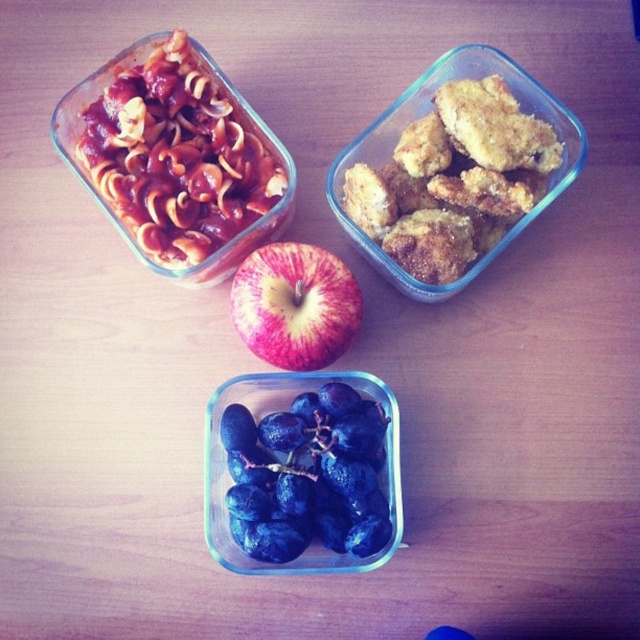
You are a food delivery person who needs to pack the crispy golden nuggets at upper right and the red matte apple at center into a small box. The box can only fit items that are both smaller than 15 cm in height. Can both items fit?

The crispy golden nuggets at upper right is larger in size than red matte apple at center. Since the box requires both items to be smaller than 15 cm in height, we need to know the exact height of the larger item. However, the description only states the relative size between them. Without specific measurements, we cannot confirm if both items meet the height requirement. Please check the actual dimensions.